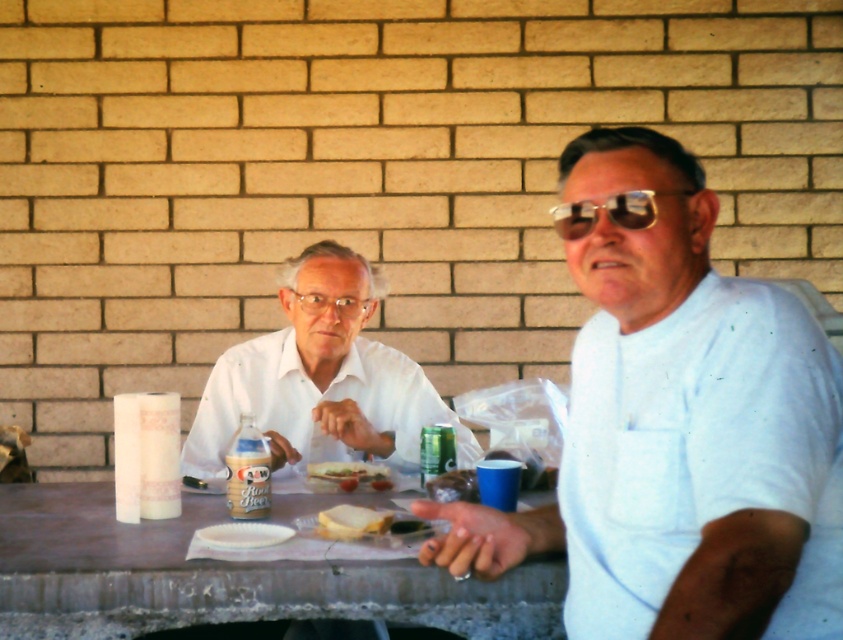
Question: Estimate the real-world distances between objects in this image. Which object is farther from the gold reflective sunglasses at center?

Choices:
 (A) white bread at center
 (B) green metallic can at center
 (C) white matte shirt at center

Answer: (C)

Question: Which point is farther to the camera?

Choices:
 (A) green metallic can at center
 (B) translucent plastic bottle at center

Answer: (A)

Question: Which of the following is the farthest from the observer?

Choices:
 (A) wooden table at center
 (B) gold reflective sunglasses at center

Answer: (A)

Question: Is white matte shirt at right smaller than white bread at center?

Choices:
 (A) no
 (B) yes

Answer: (A)

Question: Is white matte shirt at center to the right of shiny plastic container at center from the viewer's perspective?

Choices:
 (A) yes
 (B) no

Answer: (B)

Question: Where is white matte shirt at right located in relation to wooden table at center in the image?

Choices:
 (A) below
 (B) above

Answer: (B)